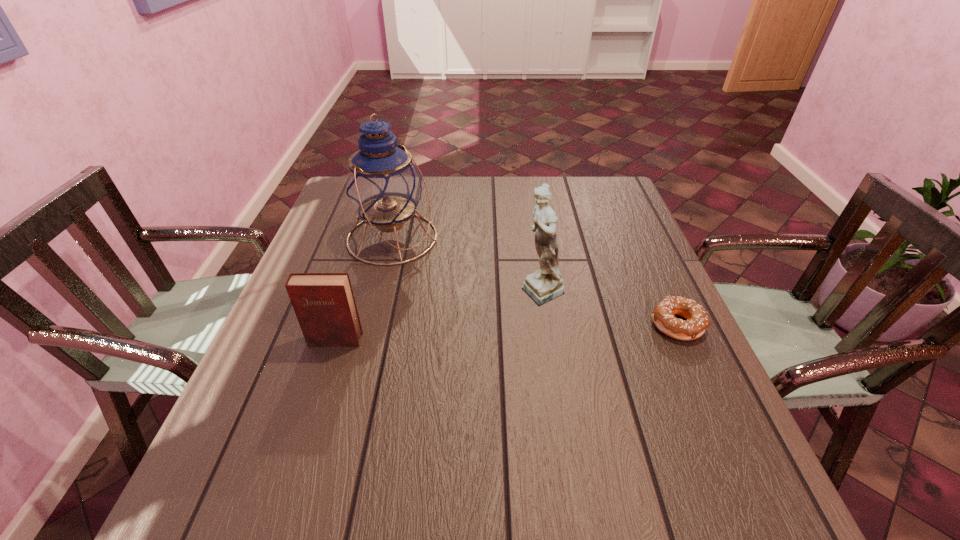
The image size is (960, 540). Find the location of `diary`. diary is located at coordinates (324, 304).

At what (x,y) coordinates should I click in order to perform the action: click on the rightmost object. Please return your answer as a coordinate pair (x, y). This screenshot has width=960, height=540. Looking at the image, I should click on (697, 320).

Find the location of a particular element. The image size is (960, 540). doughnut is located at coordinates (697, 320).

The height and width of the screenshot is (540, 960). Find the location of `the tallest object`. the tallest object is located at coordinates (383, 184).

I want to click on lantern, so click(383, 184).

Where is `the second tallest object`? This screenshot has height=540, width=960. the second tallest object is located at coordinates pos(545,284).

Find the location of a particular element. Image resolution: width=960 pixels, height=540 pixels. the second object from right to left is located at coordinates (545, 284).

Where is `vacant region located on the front cover of the diary`? Image resolution: width=960 pixels, height=540 pixels. vacant region located on the front cover of the diary is located at coordinates (321, 387).

Identify the location of vacant position located 0.350m on the left of the rightmost object. (495, 325).

Find the location of a particular element. vacant space situated on the front-facing side of the lantern is located at coordinates (441, 265).